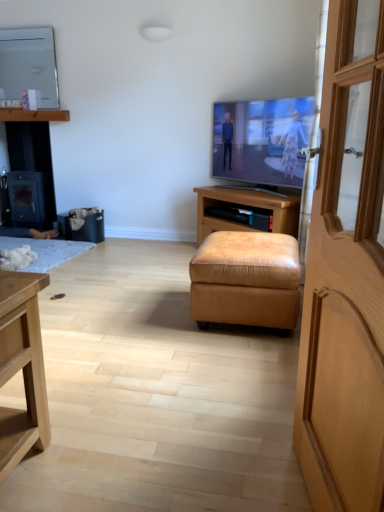
Question: From the image's perspective, is white fluffy rug at lower left located above or below flat screen tv at center, positioned as the 2th television in back-to-front order?

Choices:
 (A) above
 (B) below

Answer: (B)

Question: Is point (23, 240) positioned closer to the camera than point (251, 118)?

Choices:
 (A) farther
 (B) closer

Answer: (A)

Question: Which is farther from the wooden shelf at upper left, arranged as the second cabinetry when viewed from the right?

Choices:
 (A) black matte wood fireplace at left
 (B) matte white mirror at upper left, which ranks as the 1th television in back-to-front order
 (C) flat screen tv at center, which ranks as the 2th television in left-to-right order
 (D) white fluffy rug at lower left
 (E) tan leather ottoman at center

Answer: (E)

Question: Which object is the closest to the black matte wood fireplace at left?

Choices:
 (A) matte white mirror at upper left, the second television ordered from the bottom
 (B) wooden door at right
 (C) black leather trash bin/can at lower left
 (D) white fluffy rug at lower left
 (E) leather ottoman at center, positioned as the 1th cabinetry in front-to-back order

Answer: (A)